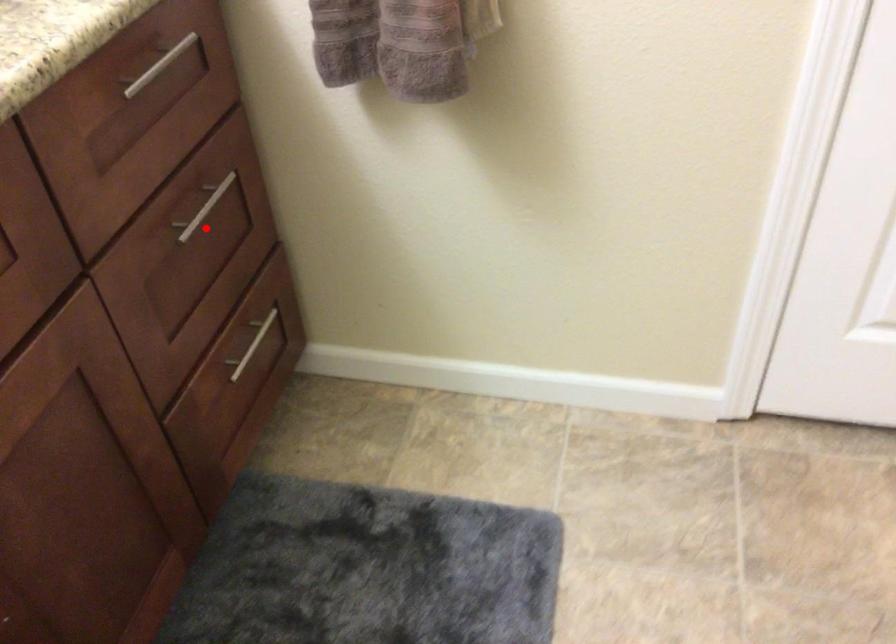
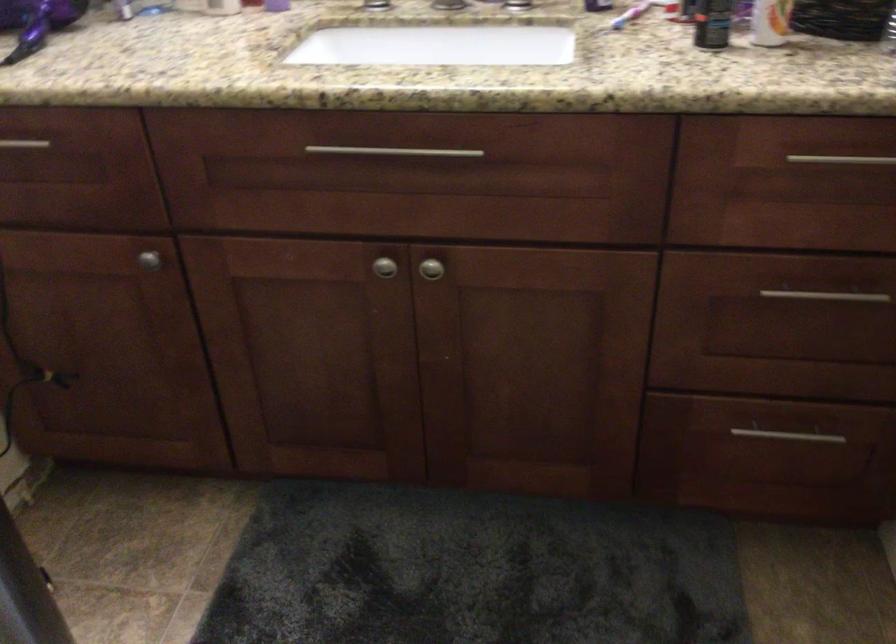
Locate, in the second image, the point that corresponds to the highlighted location in the first image.

(815, 310)